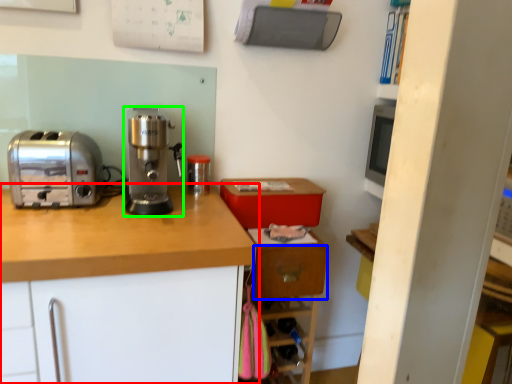
Question: Considering the real-world distances, which object is closest to cabinetry (highlighted by a red box)? drawer (highlighted by a blue box) or home appliance (highlighted by a green box).

Choices:
 (A) drawer
 (B) home appliance

Answer: (B)